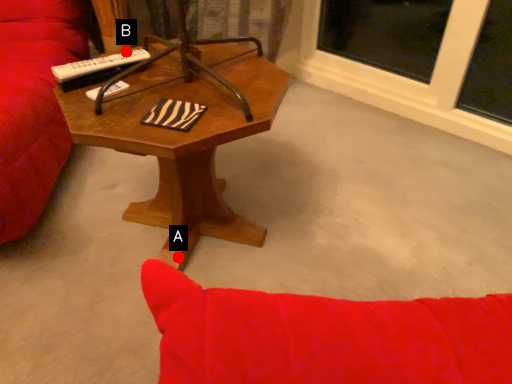
Question: Two points are circled on the image, labeled by A and B beside each circle. Among these points, which one is farthest from the camera?

Choices:
 (A) A is further
 (B) B is further

Answer: (A)